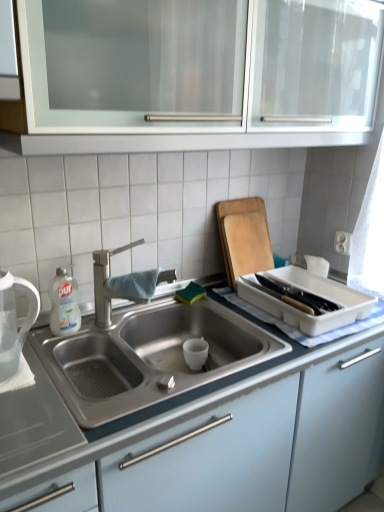
Where is `free space in front of white matte tea pot at left`? The width and height of the screenshot is (384, 512). free space in front of white matte tea pot at left is located at coordinates (34, 408).